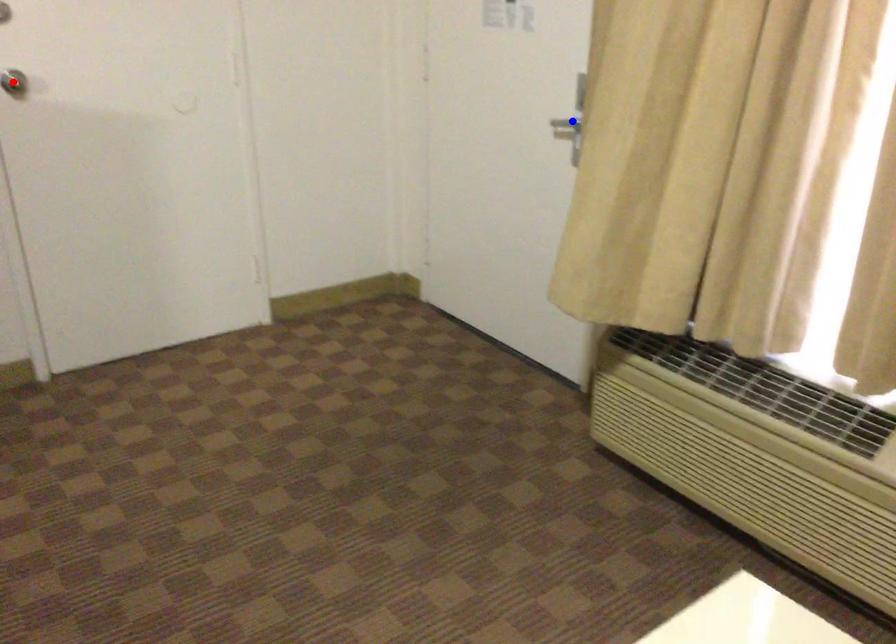
Question: Two points are marked on the image. Which point is closer to the camera?

Choices:
 (A) Blue point is closer.
 (B) Red point is closer.

Answer: (B)